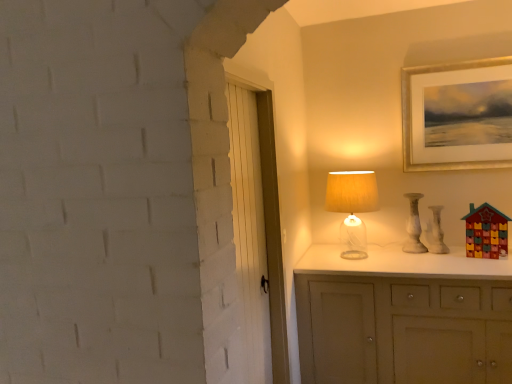
Question: Is translucent glass table lamp at upper right in front of or behind white marble vase at right in the image?

Choices:
 (A) behind
 (B) front

Answer: (B)

Question: Is translucent glass table lamp at upper right taller or shorter than white marble vase at right?

Choices:
 (A) short
 (B) tall

Answer: (B)

Question: Which object is the farthest from the white marble vase at right?

Choices:
 (A) wooden toy house at right
 (B) gold-framed picture at upper right
 (C) white painted wood door at center
 (D) translucent glass table lamp at upper right
 (E) white marble vase at right

Answer: (C)

Question: Estimate the real-world distances between objects in this image. Which object is closer to the gold-framed picture at upper right?

Choices:
 (A) white marble vase at right
 (B) wooden toy house at right
 (C) white painted wood door at center
 (D) white marble vase at right
 (E) translucent glass table lamp at upper right

Answer: (A)